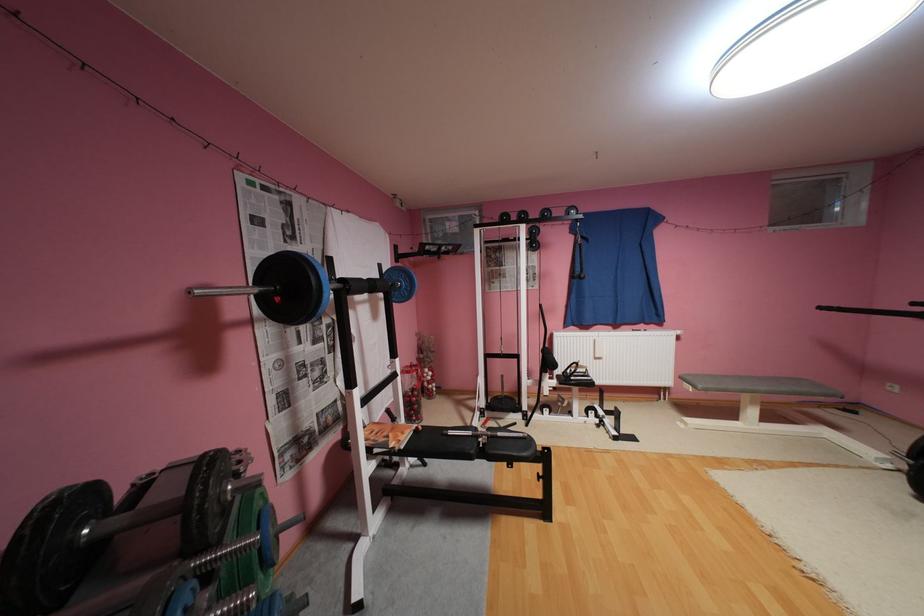
Locate an element on the screen. The width and height of the screenshot is (924, 616). metal bar attachment is located at coordinates [225, 553].